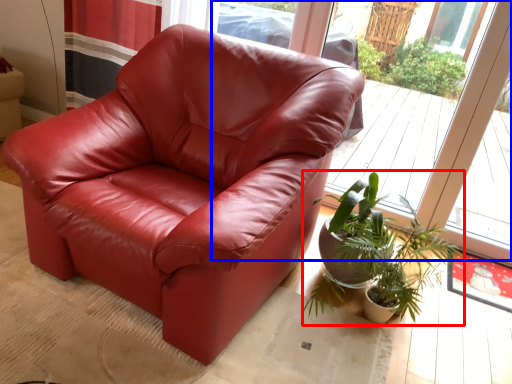
Question: Which object is closer to the camera taking this photo, houseplant (highlighted by a red box) or window (highlighted by a blue box)?

Choices:
 (A) houseplant
 (B) window

Answer: (A)